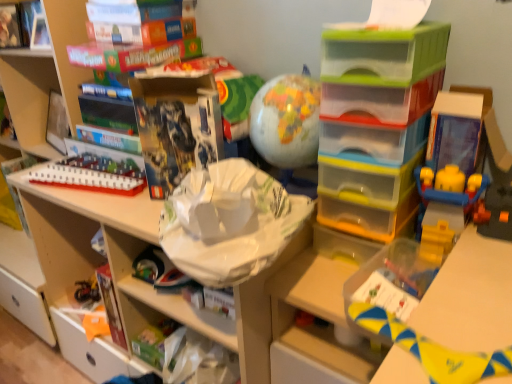
This screenshot has width=512, height=384. I want to click on vacant area on top of translucent plastic drawers at center, marked as the 2th shelf in a left-to-right arrangement (from a real-world perspective), so click(x=385, y=25).